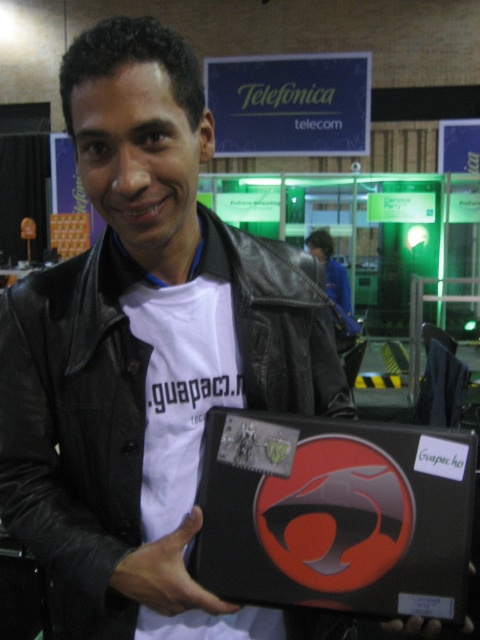
Question: Which point is farther from the camera taking this photo?

Choices:
 (A) (177, 586)
 (B) (296, 292)

Answer: (B)

Question: Which object is closer to the camera taking this photo?

Choices:
 (A) black leather jacket at center
 (B) black leather hand at center

Answer: (B)

Question: Which of the following is the closest to the observer?

Choices:
 (A) (249, 376)
 (B) (171, 566)

Answer: (B)

Question: Does black leather jacket at center have a lesser width compared to black leather hand at center?

Choices:
 (A) yes
 (B) no

Answer: (B)

Question: Is black leather jacket at center closer to the viewer compared to black leather hand at center?

Choices:
 (A) no
 (B) yes

Answer: (A)

Question: Does black leather jacket at center appear over black leather hand at center?

Choices:
 (A) no
 (B) yes

Answer: (B)